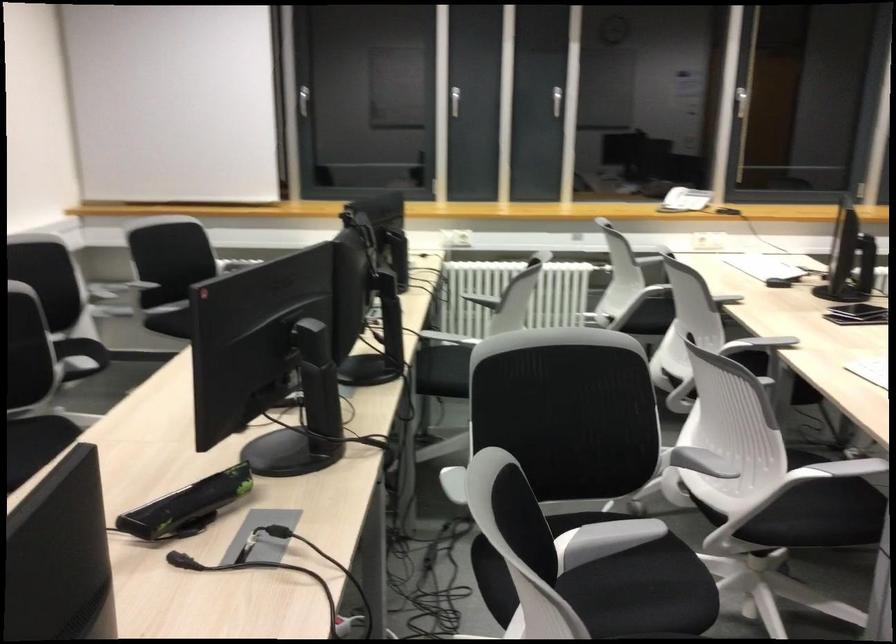
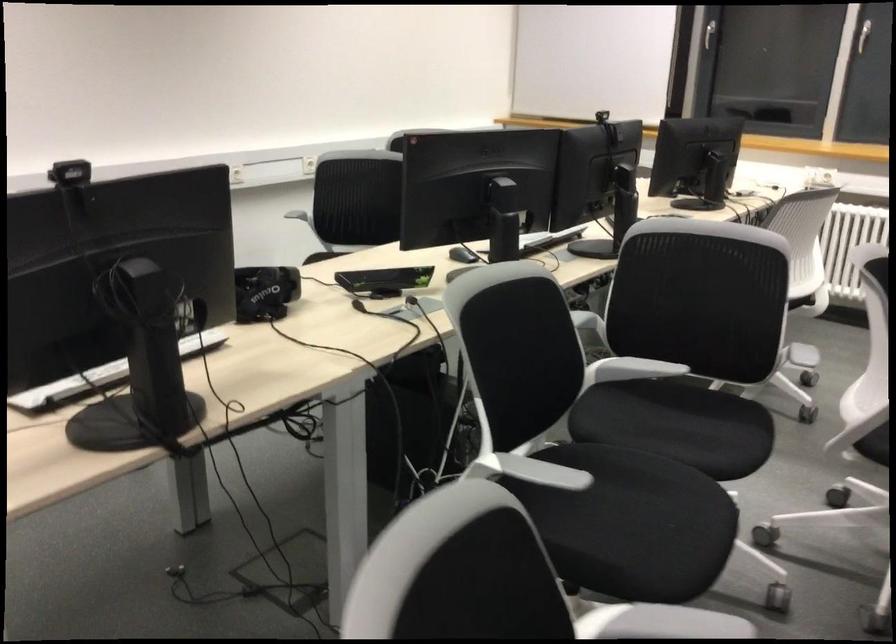
In the second image, find the point that corresponds to the point at 612,544 in the first image.

(631, 368)